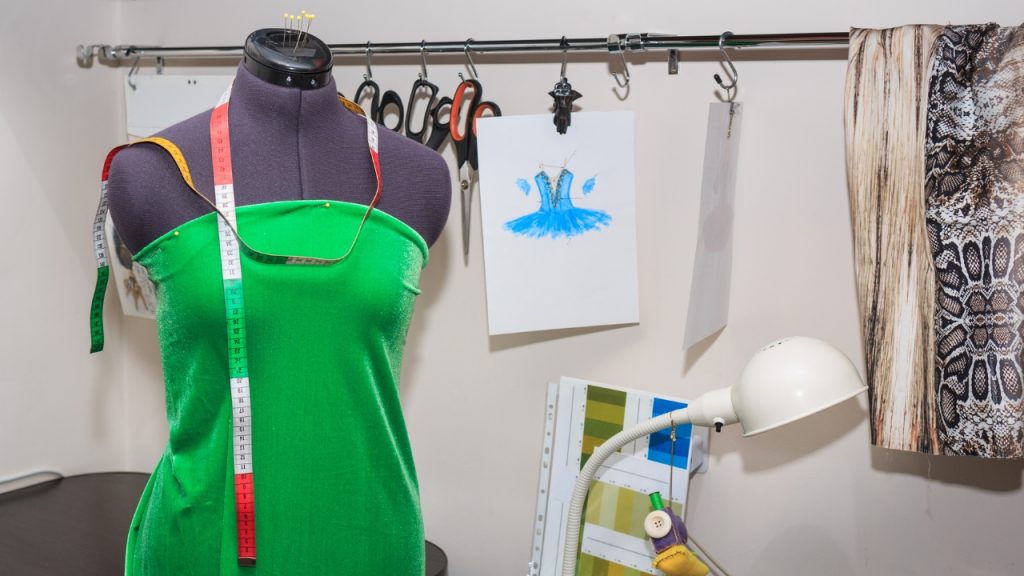
Locate an element on the screen. lamp stand is located at coordinates (572, 539).